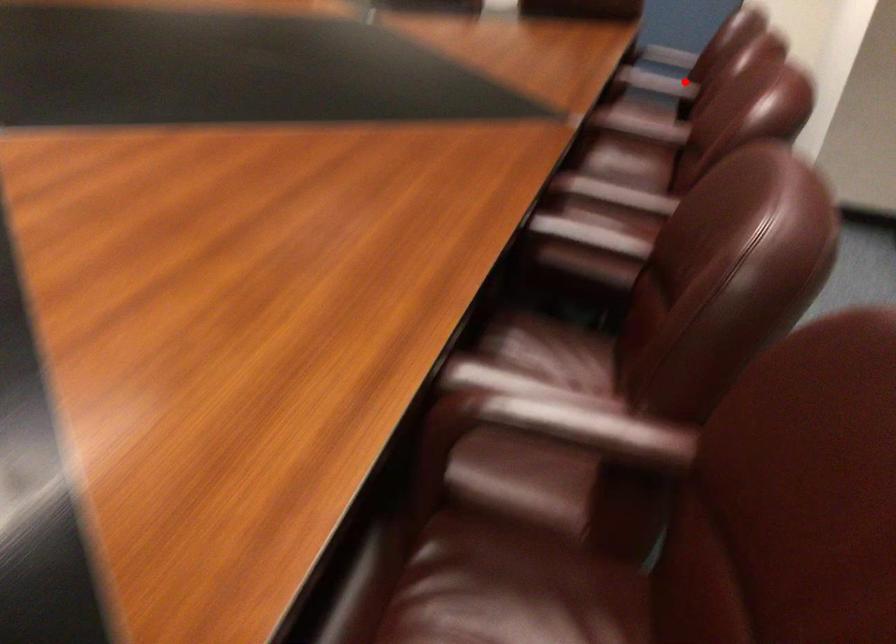
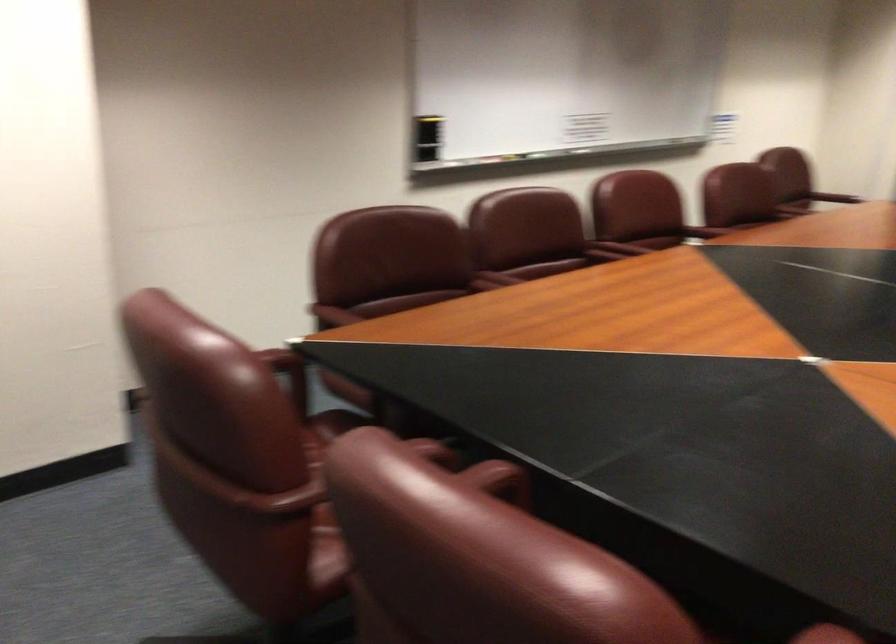
In the second image, find the point that corresponds to the highlighted location in the first image.

(497, 277)